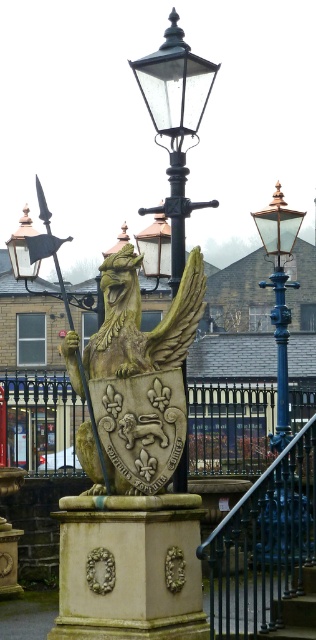
Is stone textured pedestal at center below matte brass streetlight at center?

Indeed, stone textured pedestal at center is positioned under matte brass streetlight at center.

Does point (81, 620) come farther from viewer compared to point (285, 435)?

No, it is in front of (285, 435).

Which is behind, point (80, 508) or point (279, 188)?

The point (279, 188) is behind.

This screenshot has height=640, width=316. Identify the location of stone textured pedestal at center. (129, 568).

Looking at this image, is stone textured pedestal at center below stone/golden eagle at center?

Yes, stone textured pedestal at center is below stone/golden eagle at center.

Does stone textured pedestal at center have a larger size compared to stone/golden eagle at center?

No, stone textured pedestal at center is not bigger than stone/golden eagle at center.

Does point (91, 548) lie in front of point (178, 352)?

Yes.

Identify the location of stone textured pedestal at center. (129, 568).

Locate an element on the screen. stone/golden eagle at center is located at coordinates (143, 371).

Does stone/golden eagle at center appear under blue metal railing at lower center?

No, stone/golden eagle at center is not below blue metal railing at lower center.

What do you see at coordinates (143, 371) in the screenshot?
I see `stone/golden eagle at center` at bounding box center [143, 371].

Identify the location of stone/golden eagle at center. Image resolution: width=316 pixels, height=640 pixels. (143, 371).